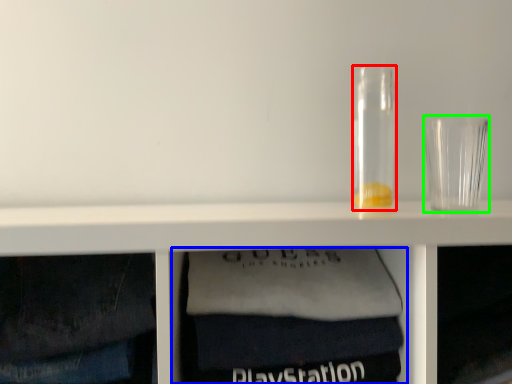
Question: Based on their relative distances, which object is nearer to glass jar (highlighted by a red box)? Choose from cabinet (highlighted by a blue box) and shot glass (highlighted by a green box).

Choices:
 (A) cabinet
 (B) shot glass

Answer: (B)